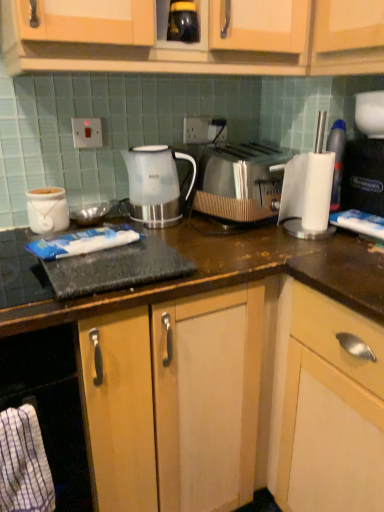
Question: From the image's perspective, is white glossy jar at left positioned above or below white plastic electric outlet at upper center, which ranks as the 1th electric outlet in back-to-front order?

Choices:
 (A) above
 (B) below

Answer: (B)

Question: Considering their positions, is white glossy jar at left located in front of or behind white plastic electric outlet at upper center, which ranks as the 1th electric outlet in back-to-front order?

Choices:
 (A) front
 (B) behind

Answer: (A)

Question: Based on their relative distances, which object is nearer to the satin silver toaster at center?

Choices:
 (A) white plastic cup at right
 (B) black plastic coffee machine at right
 (C) white glossy jar at left
 (D) translucent plastic kettle at center
 (E) white plastic electric outlet at upper center, which ranks as the 1th electric outlet in back-to-front order

Answer: (D)

Question: Which object is positioned farthest from the black glossy jar at upper center?

Choices:
 (A) white plastic cup at right
 (B) wooden cabinet at center
 (C) white glossy jar at left
 (D) black plastic coffee machine at right
 (E) translucent plastic kettle at center

Answer: (B)